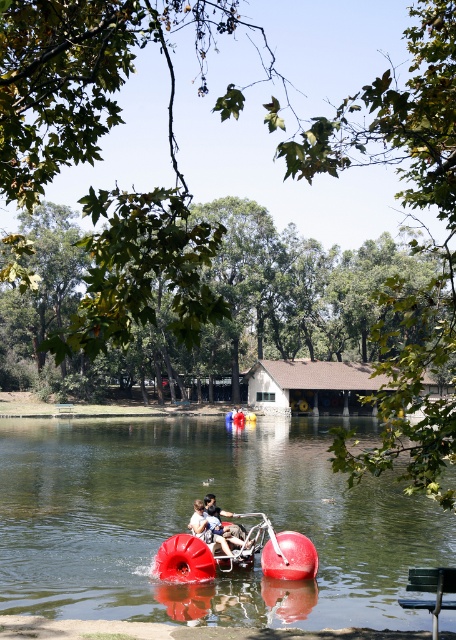
Who is more distant from viewer, (84, 563) or (212, 516)?

Positioned behind is point (84, 563).

Describe the element at coordinates (187, 520) in the screenshot. I see `red rubber water at center` at that location.

Find the location of a particular element. Image resolution: width=456 pixels, height=640 pixels. red rubber water at center is located at coordinates (187, 520).

Locate an element on the screen. The image size is (456, 640). rubberized red float at center is located at coordinates (238, 554).

Between green plastic bench at lower right and matte red lifebuoy at center, which one is positioned lower?

matte red lifebuoy at center is lower down.

In order to click on green plastic bench at lower right in this screenshot , I will do `click(430, 589)`.